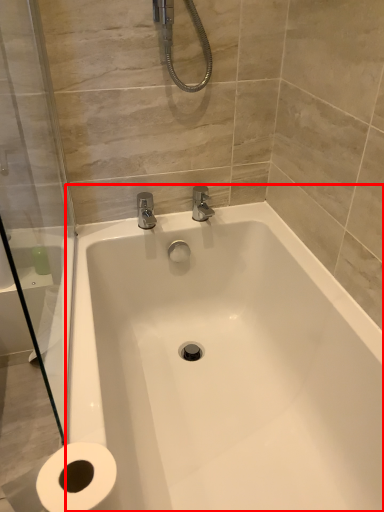
Question: From the image's perspective, what is the correct spatial positioning of bathtub (annotated by the red box) in reference to shower door?

Choices:
 (A) above
 (B) below

Answer: (B)